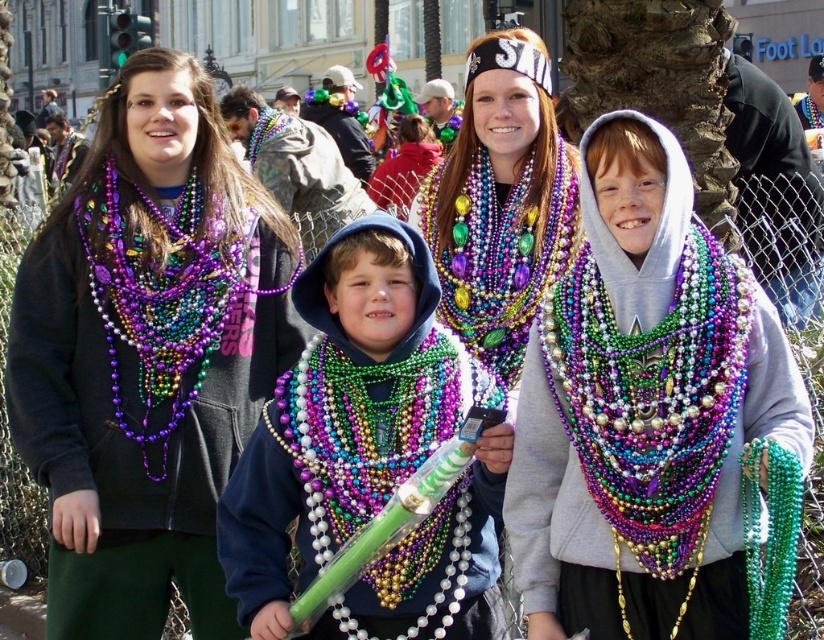
Question: Which of the following is the farthest from the observer?

Choices:
 (A) coord(188,195)
 (B) coord(775,520)

Answer: (A)

Question: Is multicolored beads at center to the right of purple beaded necklace at left from the viewer's perspective?

Choices:
 (A) yes
 (B) no

Answer: (A)

Question: Considering the real-world distances, which object is farthest from the purple matte beads at left?

Choices:
 (A) multicolored beaded necklace at center
 (B) multicolored beads necklace at center

Answer: (B)

Question: Can you confirm if multicolored beaded necklace at center is positioned above purple beaded necklace at left?

Choices:
 (A) no
 (B) yes

Answer: (A)

Question: Does multicolored beaded necklace at center appear on the left side of purple beaded necklace at left?

Choices:
 (A) yes
 (B) no

Answer: (B)

Question: Which point is closer to the camera?

Choices:
 (A) purple matte beads at left
 (B) purple beaded necklace at left
 (C) multicolored beads necklace at center
 (D) multicolored beads at center

Answer: (A)